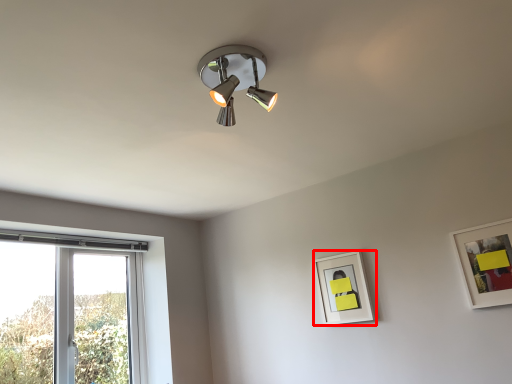
Question: From the image's perspective, where is picture frame (annotated by the red box) located relative to picture frame?

Choices:
 (A) above
 (B) below

Answer: (B)